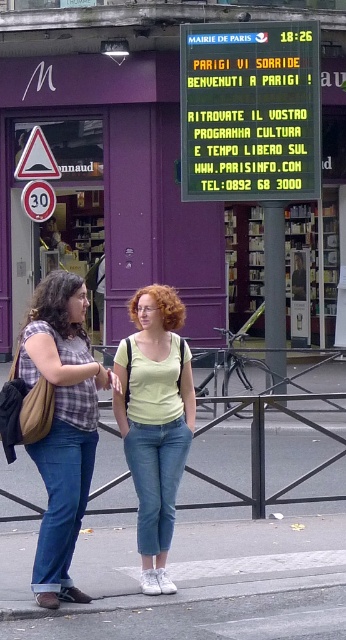
Between blue digital display at upper center and matte plaid shirt at center, which one is positioned lower?

matte plaid shirt at center

In the scene shown: Does blue digital display at upper center have a lesser height compared to matte plaid shirt at center?

In fact, blue digital display at upper center may be taller than matte plaid shirt at center.

The width and height of the screenshot is (346, 640). What do you see at coordinates (250, 112) in the screenshot? I see `blue digital display at upper center` at bounding box center [250, 112].

This screenshot has height=640, width=346. I want to click on blue digital display at upper center, so click(x=250, y=112).

Is point (260, 113) closer to camera compared to point (166, 422)?

No, it is behind (166, 422).

Who is more forward, (262, 29) or (170, 508)?

Positioned in front is point (170, 508).

The height and width of the screenshot is (640, 346). I want to click on blue digital display at upper center, so click(250, 112).

Which is above, light green cotton tank top at center or red plastic speed limit sign at left?

red plastic speed limit sign at left is above.

Is point (149, 484) in front of point (43, 193)?

Yes.

This screenshot has width=346, height=640. In order to click on light green cotton tank top at center in this screenshot , I will do pyautogui.click(x=155, y=422).